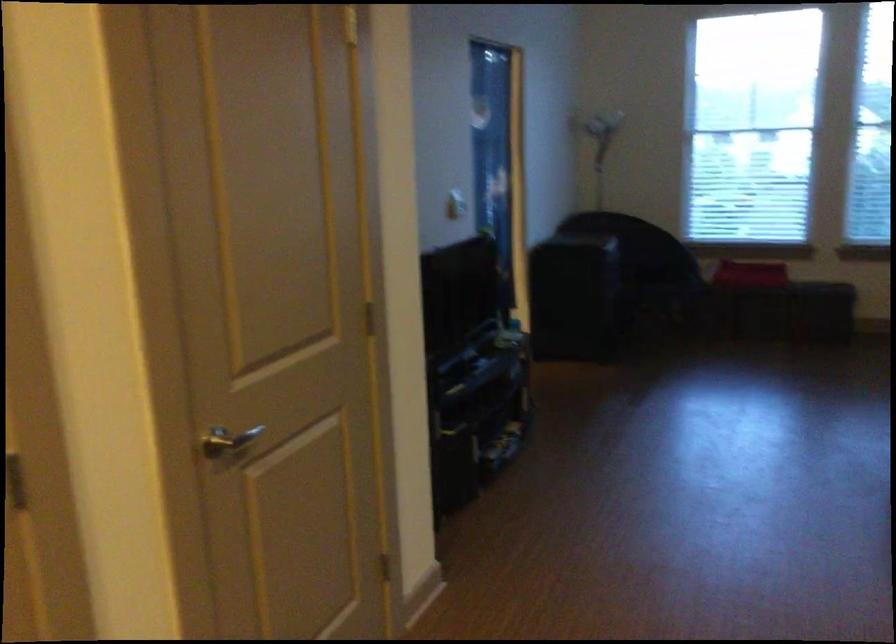
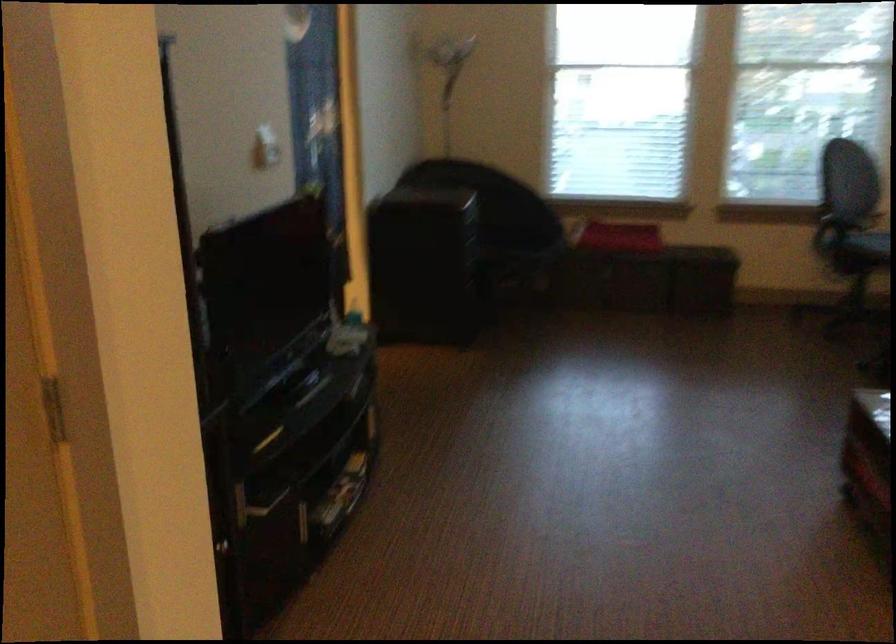
Question: Which direction would the cameraman need to move to produce the second image? Reply with the corresponding letter.

Choices:
 (A) Left
 (B) Right
 (C) Forward
 (D) Backward

Answer: (C)